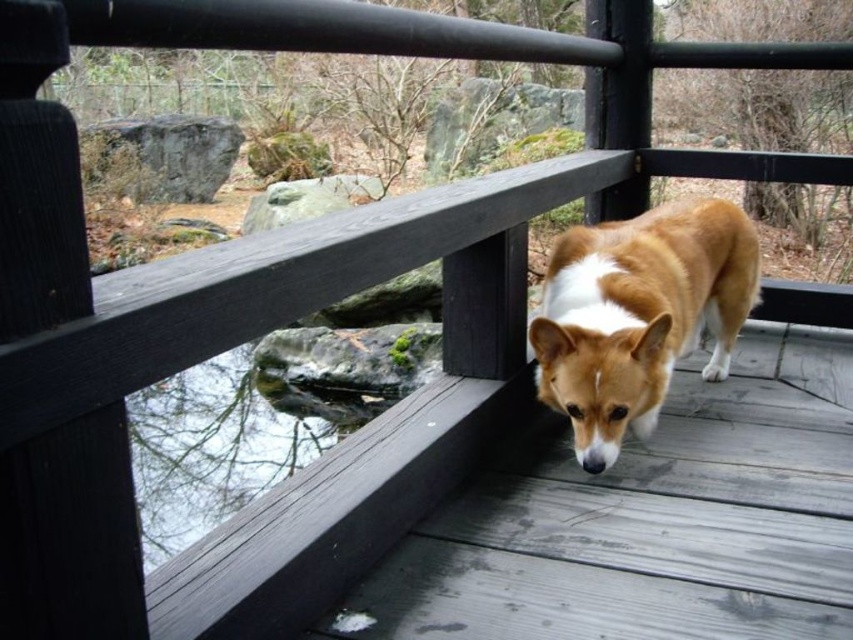
You are standing at the edge of the wooden deck at center. If you walk straight ahead, will you step onto the ground or stay on the deck?

You will step onto the ground because the wooden deck at center is located at point (648, 520), which is near the edge leading to the ground.